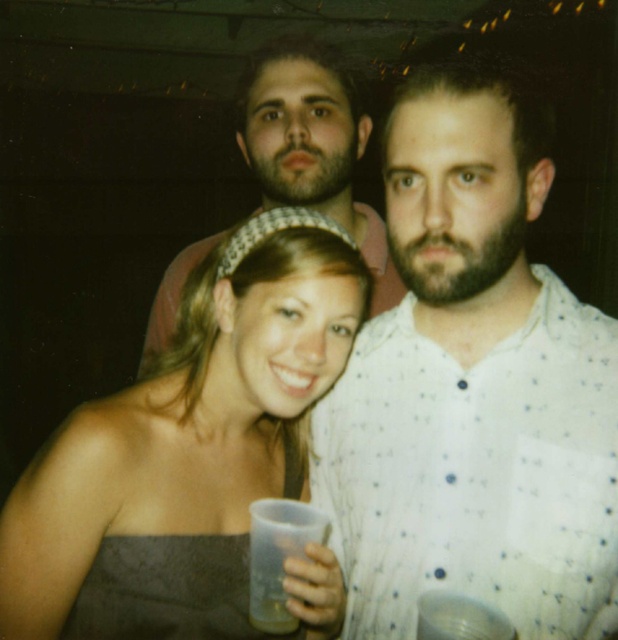
Who is positioned more to the right, white dotted shirt at center or matte pink shirt at center?

white dotted shirt at center

Who is more distant from viewer, (483, 344) or (328, 83)?

The point (328, 83) is more distant.

Measure the distance between point (499, 513) and camera.

Point (499, 513) and camera are 34.30 inches apart from each other.

Where is `white dotted shirt at center`? This screenshot has width=618, height=640. white dotted shirt at center is located at coordinates (473, 387).

Which is above, white dotted shirt at center or matte gray dress at center?

white dotted shirt at center is higher up.

Is white dotted shirt at center bigger than matte gray dress at center?

No, white dotted shirt at center is not bigger than matte gray dress at center.

Who is more distant from viewer, (x=451, y=316) or (x=336, y=589)?

The point (x=451, y=316) is more distant.

Where is `white dotted shirt at center`? Image resolution: width=618 pixels, height=640 pixels. white dotted shirt at center is located at coordinates pos(473,387).

Is matte gray dress at center wider than matte pink shirt at center?

No.

Which is more to the right, matte gray dress at center or matte pink shirt at center?

A: From the viewer's perspective, matte gray dress at center appears more on the right side.

Locate an element on the screen. This screenshot has height=640, width=618. matte gray dress at center is located at coordinates (188, 420).